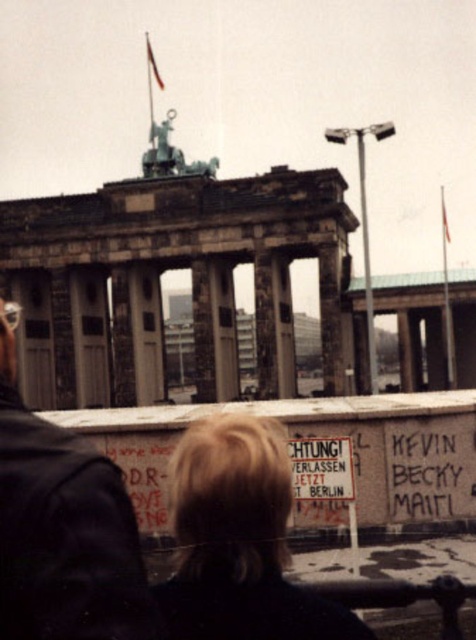
Based on the photo, is dark gray jacket at center positioned behind blonde hair at lower center?

No.

Can you confirm if dark gray jacket at center is thinner than blonde hair at lower center?

Incorrect, dark gray jacket at center's width is not less than blonde hair at lower center's.

Does point (117, 470) lie behind point (274, 480)?

No, it is in front of (274, 480).

This screenshot has width=476, height=640. Find the location of `dark gray jacket at center`. dark gray jacket at center is located at coordinates (62, 528).